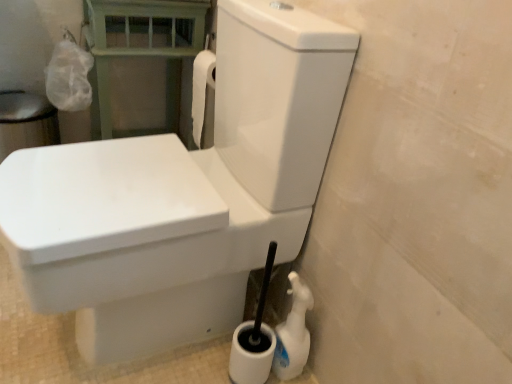
Question: In the image, is white plastic spray bottle at lower right on the left side or the right side of green painted wood balustrade at upper left?

Choices:
 (A) right
 (B) left

Answer: (A)

Question: Looking at their shapes, would you say white plastic spray bottle at lower right is wider or thinner than green painted wood balustrade at upper left?

Choices:
 (A) wide
 (B) thin

Answer: (B)

Question: Which object is the closest to the green painted wood balustrade at upper left?

Choices:
 (A) white plastic spray bottle at lower right
 (B) white glossy toilet at center

Answer: (B)

Question: Estimate the real-world distances between objects in this image. Which object is farther from the white glossy toilet at center?

Choices:
 (A) white plastic spray bottle at lower right
 (B) green painted wood balustrade at upper left

Answer: (B)